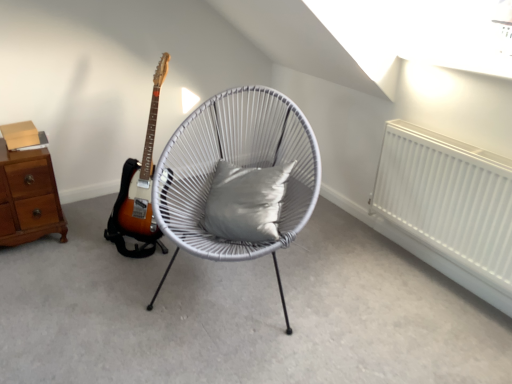
Question: From a real-world perspective, is white matte radiator at right physically above gray fabric pillow at center?

Choices:
 (A) yes
 (B) no

Answer: (B)

Question: Would you say white matte radiator at right is a long distance from gray fabric pillow at center?

Choices:
 (A) yes
 (B) no

Answer: (B)

Question: Is white matte radiator at right turned away from gray fabric pillow at center?

Choices:
 (A) no
 (B) yes

Answer: (A)

Question: From a real-world perspective, is white matte radiator at right below gray fabric pillow at center?

Choices:
 (A) yes
 (B) no

Answer: (A)

Question: Does white matte radiator at right have a larger size compared to gray fabric pillow at center?

Choices:
 (A) no
 (B) yes

Answer: (B)

Question: Is white matte radiator at right situated inside gray fabric pillow at center or outside?

Choices:
 (A) inside
 (B) outside

Answer: (B)

Question: Is white matte radiator at right wider or thinner than gray fabric pillow at center?

Choices:
 (A) wide
 (B) thin

Answer: (B)

Question: From the image's perspective, is white matte radiator at right above or below gray fabric pillow at center?

Choices:
 (A) above
 (B) below

Answer: (B)

Question: From a real-world perspective, is white matte radiator at right positioned above or below gray fabric pillow at center?

Choices:
 (A) above
 (B) below

Answer: (B)

Question: Is white woven chair at center bigger or smaller than brown wood chest of drawers at left?

Choices:
 (A) big
 (B) small

Answer: (A)

Question: From a real-world perspective, is white woven chair at center physically located above or below brown wood chest of drawers at left?

Choices:
 (A) above
 (B) below

Answer: (A)

Question: Considering the positions of point (302, 188) and point (7, 230), is point (302, 188) closer or farther from the camera than point (7, 230)?

Choices:
 (A) closer
 (B) farther

Answer: (A)

Question: Relative to brown wood chest of drawers at left, is white woven chair at center in front or behind?

Choices:
 (A) front
 (B) behind

Answer: (A)

Question: Is white matte radiator at right taller or shorter than brown wood chest of drawers at left?

Choices:
 (A) tall
 (B) short

Answer: (A)

Question: From a real-world perspective, is white matte radiator at right physically located above or below brown wood chest of drawers at left?

Choices:
 (A) above
 (B) below

Answer: (A)